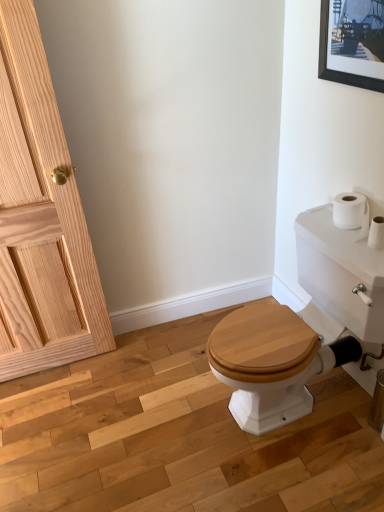
Describe the element at coordinates (352, 42) in the screenshot. I see `black matte picture frame at upper right` at that location.

The image size is (384, 512). Identify the location of white glossy porcelain at right. (302, 327).

Considering the sizes of objects white matte toilet paper at upper right and black matte picture frame at upper right in the image provided, who is smaller, white matte toilet paper at upper right or black matte picture frame at upper right?

white matte toilet paper at upper right is smaller.

Considering the sizes of objects white matte toilet paper at upper right and black matte picture frame at upper right in the image provided, who is shorter, white matte toilet paper at upper right or black matte picture frame at upper right?

white matte toilet paper at upper right is shorter.

Is white matte toilet paper at upper right far from black matte picture frame at upper right?

That's not correct — white matte toilet paper at upper right is a little close to black matte picture frame at upper right.

Is white matte toilet paper at upper right oriented towards black matte picture frame at upper right?

No, white matte toilet paper at upper right is not turned towards black matte picture frame at upper right.

What's the angular difference between white matte toilet paper at upper right and natural wood door at left's facing directions?

There is a 85.6-degree angle between the facing directions of white matte toilet paper at upper right and natural wood door at left.

Considering the positions of objects white matte toilet paper at upper right and natural wood door at left in the image provided, who is in front, white matte toilet paper at upper right or natural wood door at left?

natural wood door at left.

Where is `door to the left of white matte toilet paper at upper right`? door to the left of white matte toilet paper at upper right is located at coordinates (41, 218).

Could you measure the distance between black matte picture frame at upper right and white matte toilet paper at upper right?

The distance of black matte picture frame at upper right from white matte toilet paper at upper right is 50.89 centimeters.

Considering the sizes of objects black matte picture frame at upper right and white matte toilet paper at upper right in the image provided, who is wider, black matte picture frame at upper right or white matte toilet paper at upper right?

white matte toilet paper at upper right is wider.

This screenshot has height=512, width=384. Identify the location of toilet paper below the black matte picture frame at upper right (from the image's perspective). click(x=356, y=216).

Is black matte picture frame at upper right inside the boundaries of white matte toilet paper at upper right, or outside?

The correct answer is: outside.

Does white matte toilet paper at upper right appear on the right side of white glossy porcelain at right?

Indeed, white matte toilet paper at upper right is positioned on the right side of white glossy porcelain at right.

From the image's perspective, is white matte toilet paper at upper right on white glossy porcelain at right?

Indeed, from the image's perspective, white matte toilet paper at upper right is shown above white glossy porcelain at right.

How many degrees apart are the facing directions of white matte toilet paper at upper right and white glossy porcelain at right?

0.416 degrees.

Which object is thinner, white matte toilet paper at upper right or white glossy porcelain at right?

white matte toilet paper at upper right is thinner.

From a real-world perspective, between white glossy porcelain at right and white matte toilet paper at upper right, who is vertically lower?

In real-world perspective, white glossy porcelain at right is lower.

Is white glossy porcelain at right far away from white matte toilet paper at upper right?

No, white glossy porcelain at right is not far from white matte toilet paper at upper right.

Between white glossy porcelain at right and white matte toilet paper at upper right, which one has more height?

Standing taller between the two is white glossy porcelain at right.

Is the depth of white glossy porcelain at right less than that of white matte toilet paper at upper right?

Yes, it is in front of white matte toilet paper at upper right.

Where is `door below the black matte picture frame at upper right (from a real-world perspective)`? door below the black matte picture frame at upper right (from a real-world perspective) is located at coordinates (41, 218).

From the image's perspective, is natural wood door at left on black matte picture frame at upper right?

No, from the image's perspective, natural wood door at left is not above black matte picture frame at upper right.

Which point is more forward, (48, 297) or (377, 64)?

Point (377, 64)

Can you confirm if natural wood door at left is positioned to the left of black matte picture frame at upper right?

Correct, you'll find natural wood door at left to the left of black matte picture frame at upper right.

Looking at this image, is black matte picture frame at upper right touching white glossy porcelain at right?

A: No, black matte picture frame at upper right is not making contact with white glossy porcelain at right.

Is black matte picture frame at upper right aimed at white glossy porcelain at right?

No, black matte picture frame at upper right is not facing towards white glossy porcelain at right.

Which is behind, point (375, 57) or point (243, 318)?

Point (243, 318)

Identify the location of toilet paper on the right of the black matte picture frame at upper right. (356, 216).

I want to click on door beneath the white matte toilet paper at upper right (from a real-world perspective), so pyautogui.click(x=41, y=218).

Based on their spatial positions, is white glossy porcelain at right or white matte toilet paper at upper right further from natural wood door at left?

Based on the image, white matte toilet paper at upper right appears to be further to natural wood door at left.

From the picture: Estimate the real-world distances between objects in this image. Which object is further from white glossy porcelain at right, natural wood door at left or black matte picture frame at upper right?

natural wood door at left is further to white glossy porcelain at right.

Based on their spatial positions, is white glossy porcelain at right or natural wood door at left closer to white matte toilet paper at upper right?

white glossy porcelain at right lies closer to white matte toilet paper at upper right than the other object.

Estimate the real-world distances between objects in this image. Which object is further from white matte toilet paper at upper right, natural wood door at left or black matte picture frame at upper right?

natural wood door at left.

Considering their positions, is white matte toilet paper at upper right positioned further to natural wood door at left than white glossy porcelain at right?

Among the two, white matte toilet paper at upper right is located further to natural wood door at left.

Estimate the real-world distances between objects in this image. Which object is further from white matte toilet paper at upper right, white glossy porcelain at right or black matte picture frame at upper right?

black matte picture frame at upper right lies further to white matte toilet paper at upper right than the other object.

Estimate the real-world distances between objects in this image. Which object is closer to white matte toilet paper at upper right, natural wood door at left or white glossy porcelain at right?

white glossy porcelain at right is positioned closer to the anchor white matte toilet paper at upper right.

When comparing their distances from natural wood door at left, does white glossy porcelain at right or black matte picture frame at upper right seem further?

The object further to natural wood door at left is black matte picture frame at upper right.

This screenshot has width=384, height=512. In order to click on picture frame situated between natural wood door at left and white matte toilet paper at upper right from left to right in this screenshot , I will do `click(352, 42)`.

This screenshot has height=512, width=384. I want to click on porcelain between natural wood door at left and black matte picture frame at upper right, so click(x=302, y=327).

Find the location of a particular element. The width and height of the screenshot is (384, 512). porcelain between natural wood door at left and white matte toilet paper at upper right is located at coordinates (302, 327).

I want to click on toilet paper between black matte picture frame at upper right and white glossy porcelain at right in the vertical direction, so pyautogui.click(x=356, y=216).